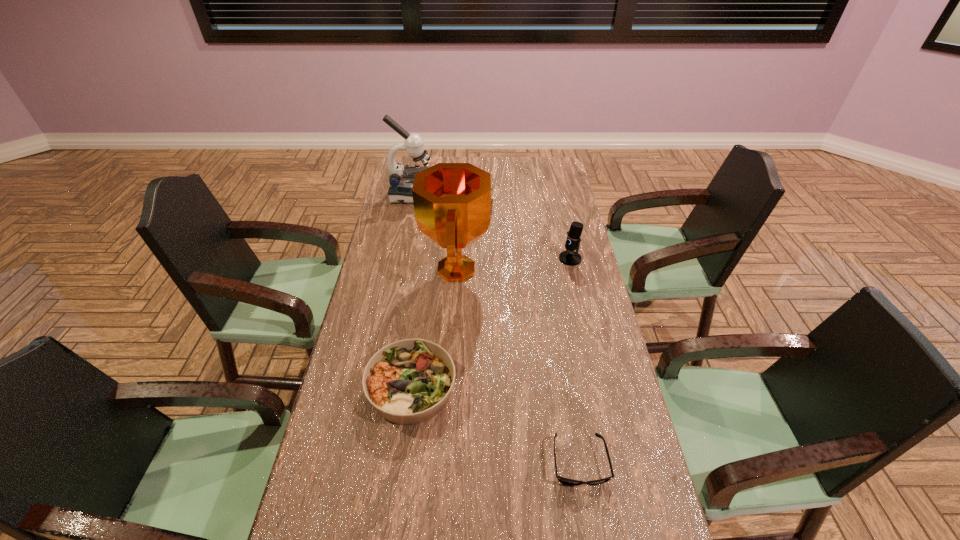
Locate an element on the screen. The width and height of the screenshot is (960, 540). free space located 0.110m on the front of the fourth farthest object is located at coordinates (400, 472).

I want to click on vacant space situated on the front-facing side of the sunglasses, so click(588, 512).

Locate an element on the screen. This screenshot has height=540, width=960. microscope at the left edge is located at coordinates (401, 179).

The height and width of the screenshot is (540, 960). In order to click on salad plate present at the left edge in this screenshot , I will do `click(409, 381)`.

Find the location of a particular element. microphone at the right edge is located at coordinates (569, 257).

Image resolution: width=960 pixels, height=540 pixels. Identify the location of sunglasses that is at the right edge. (563, 480).

At what (x,y) coordinates should I click in order to perform the action: click on vacant region at the far edge. Please return your answer as a coordinate pair (x, y). Image resolution: width=960 pixels, height=540 pixels. Looking at the image, I should click on (432, 158).

Locate an element on the screen. This screenshot has height=540, width=960. free space at the left edge of the desktop is located at coordinates (374, 459).

In the image, there is a desktop. What are the coordinates of `vacant region at the right edge` in the screenshot? It's located at (602, 354).

Where is `vacant space at the far left corner of the desktop`? The width and height of the screenshot is (960, 540). vacant space at the far left corner of the desktop is located at coordinates (420, 164).